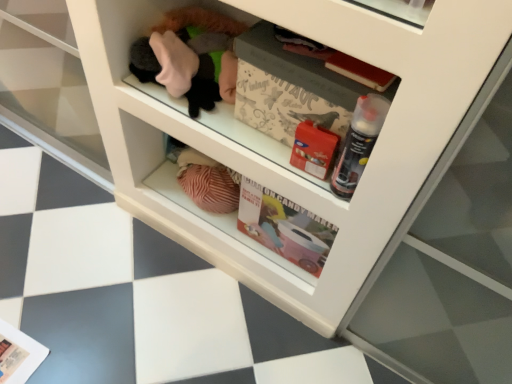
Question: Is matte paper magazine at lower left, the second magazine when ordered from front to back, to the left of translucent plastic spray can at center right from the viewer's perspective?

Choices:
 (A) no
 (B) yes

Answer: (B)

Question: Is the position of matte paper magazine at lower left, the second magazine when ordered from front to back, less distant than that of translucent plastic spray can at center right?

Choices:
 (A) yes
 (B) no

Answer: (B)

Question: Can you confirm if matte paper magazine at lower left, which appears as the second magazine when viewed from the top, is taller than translucent plastic spray can at center right?

Choices:
 (A) yes
 (B) no

Answer: (B)

Question: Would you say matte paper magazine at lower left, which appears as the second magazine when viewed from the top, contains translucent plastic spray can at center right?

Choices:
 (A) no
 (B) yes

Answer: (A)

Question: From the image's perspective, would you say matte paper magazine at lower left, which ranks as the first magazine in left-to-right order, is positioned over translucent plastic spray can at center right?

Choices:
 (A) no
 (B) yes

Answer: (A)

Question: Visually, is white paper magazine at center, the first magazine from the front, positioned to the left or to the right of matte paper magazine at lower left, the first magazine positioned from the back?

Choices:
 (A) right
 (B) left

Answer: (A)

Question: Looking at the image, does white paper magazine at center, the 2th magazine when ordered from bottom to top, seem bigger or smaller compared to matte paper magazine at lower left, the second magazine when ordered from front to back?

Choices:
 (A) small
 (B) big

Answer: (B)

Question: Is white paper magazine at center, the first magazine from the front, in front of or behind matte paper magazine at lower left, which ranks as the first magazine in left-to-right order, in the image?

Choices:
 (A) front
 (B) behind

Answer: (A)

Question: In terms of width, does white paper magazine at center, positioned as the second magazine in back-to-front order, look wider or thinner when compared to matte paper magazine at lower left, acting as the second magazine starting from the right?

Choices:
 (A) wide
 (B) thin

Answer: (B)

Question: Based on their positions, is white paper magazine at center, the 2th magazine when ordered from bottom to top, located to the left or right of translucent plastic spray can at center right?

Choices:
 (A) left
 (B) right

Answer: (A)

Question: In terms of width, does white paper magazine at center, placed as the 1th magazine when sorted from top to bottom, look wider or thinner when compared to translucent plastic spray can at center right?

Choices:
 (A) thin
 (B) wide

Answer: (B)

Question: Is point (236, 91) closer or farther from the camera than point (379, 114)?

Choices:
 (A) farther
 (B) closer

Answer: (A)

Question: From the image's perspective, is white paper magazine at center, the first magazine from the front, positioned above or below translucent plastic spray can at center right?

Choices:
 (A) above
 (B) below

Answer: (A)

Question: Looking at their shapes, would you say matte paper magazine at lower left, acting as the second magazine starting from the right, is wider or thinner than translucent plastic spray can at center right?

Choices:
 (A) thin
 (B) wide

Answer: (B)

Question: In terms of size, does matte paper magazine at lower left, the second magazine when ordered from front to back, appear bigger or smaller than translucent plastic spray can at center right?

Choices:
 (A) big
 (B) small

Answer: (B)